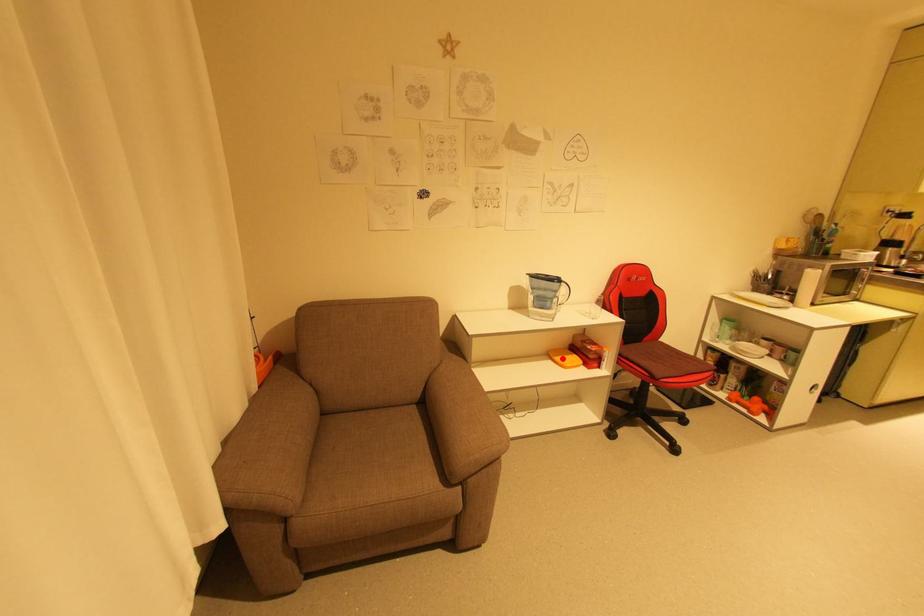
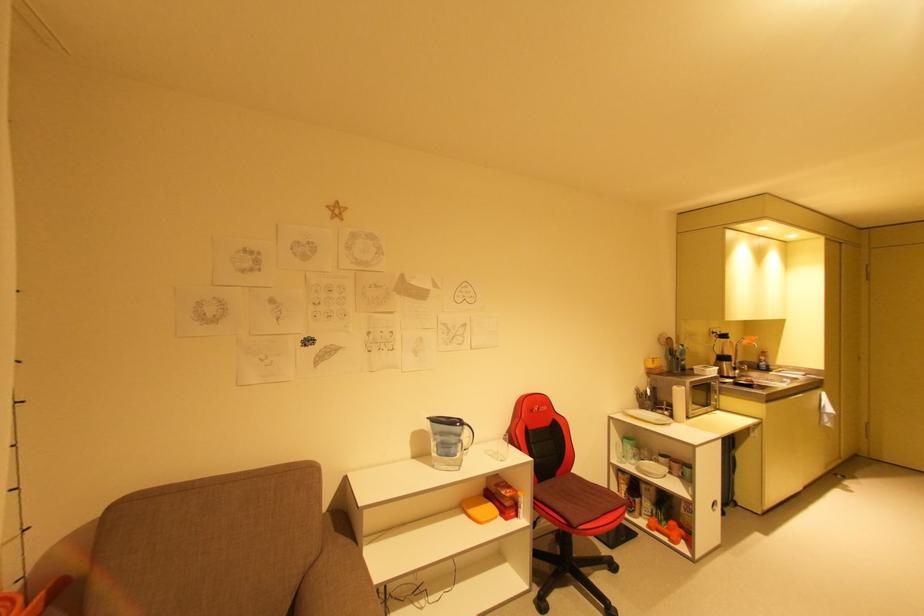
The point at the highlighted location is marked in the first image. Where is the corresponding point in the second image?

(477, 512)